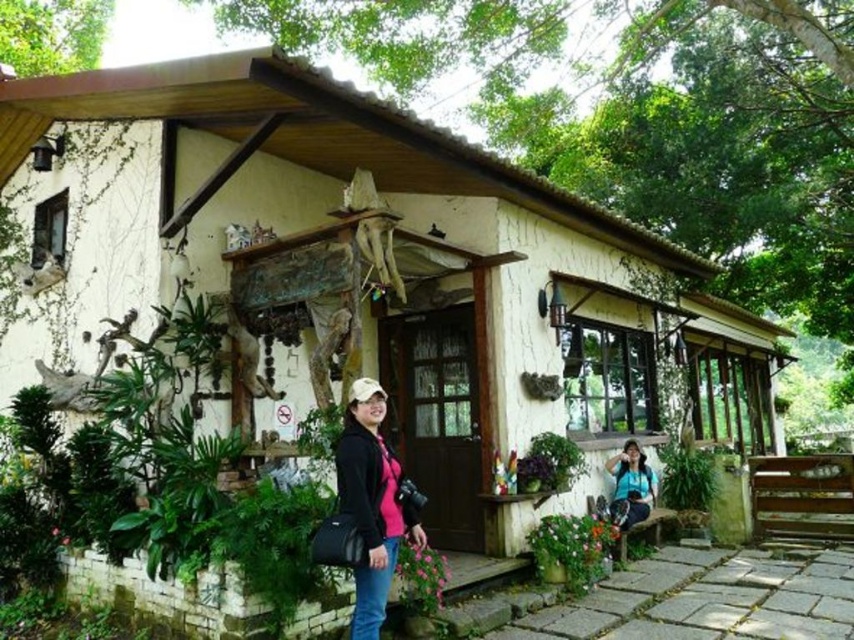
Looking at this image, you are standing on the front porch of the rustic house and notice a pink matte jacket at center and a matte black camera at lower right. Which object is positioned to the left when facing the house?

The pink matte jacket at center is positioned to the left of the matte black camera at lower right when facing the house.

You are standing on the front porch of the rustic house and want to take a photo. There are two points marked in the scene, point 1 at coordinates point (367, 616) and point 2 at coordinates point (612, 500). Which point should you focus on to ensure it appears closer in your photo?

Point (367, 616) is closer to the camera than point (612, 500), so focusing on point (367, 616) will ensure it appears closer in your photo.